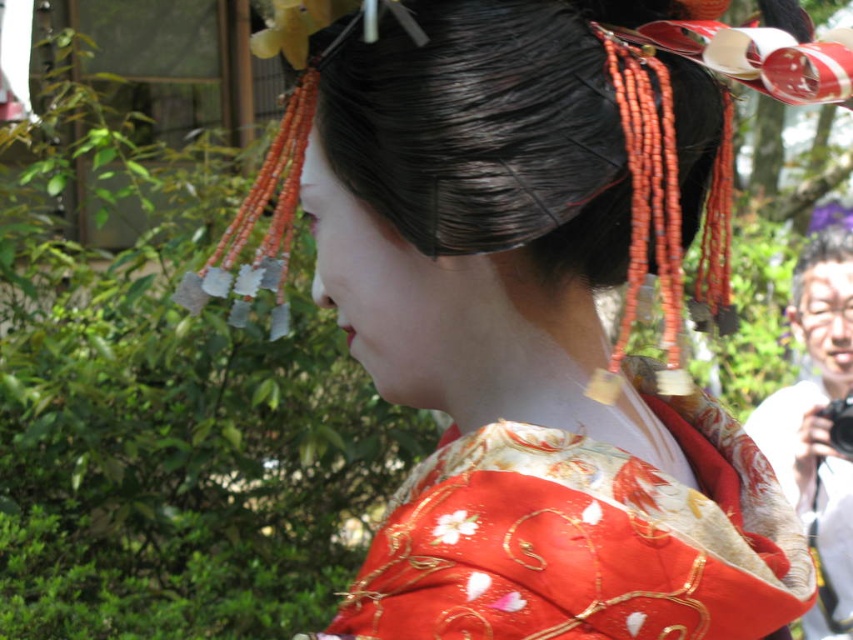
You are organizing a cultural exhibition and need to display both the silky kimono at center and the silky red kimono at center. Since space is limited, you must choose which kimono to display first based on their sizes. Which kimono should be placed first in the display?

The silky kimono at center should be placed first because it is bigger than the silky red kimono at center, making it more visually impactful for the exhibition.

From the picture: You are standing in front of the person wearing the kimono and want to know which of the two points, point (805, 573) or point (851, 246), is nearer to you. Can you determine this based on the image?

Point (805, 573) is closer to the viewer than point (851, 246).

You are standing in front of the person wearing the kimono. There are two points marked on their outfit. The first point is at coordinate point (450,154) and the second is at point (834,259). Which point is closer to you?

Point (450,154) is in front of point (834,259), so the first point is closer to you.